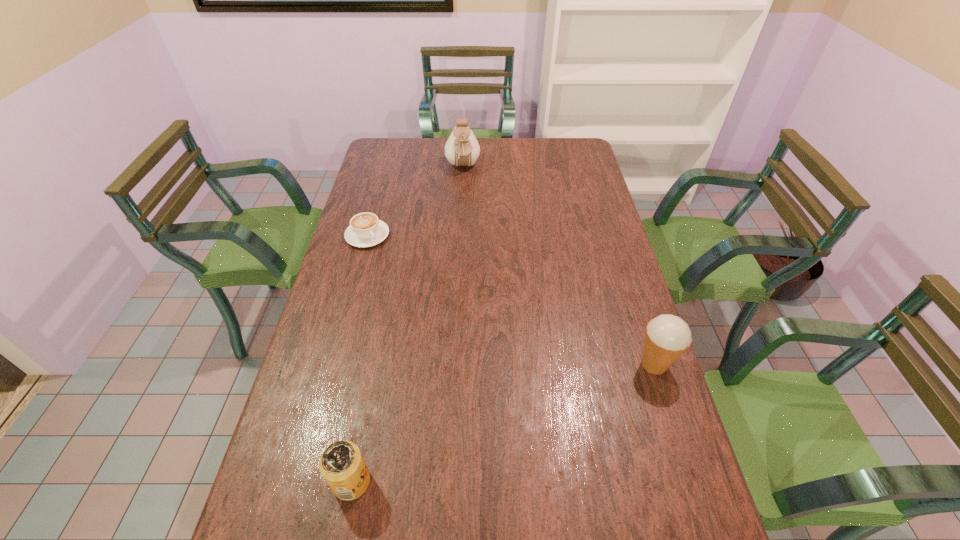
You are a GUI agent. You are given a task and a screenshot of the screen. Output one action in this format:
    pyautogui.click(x=<x>, y=<y>)
    Task: Click on the nearest object
    The image size is (960, 540).
    Given the screenshot: What is the action you would take?
    pyautogui.click(x=342, y=465)

Where is `the third tallest object`? the third tallest object is located at coordinates (342, 465).

Where is `the rightmost object`? the rightmost object is located at coordinates (667, 337).

Where is `the second nearest object`? This screenshot has height=540, width=960. the second nearest object is located at coordinates (667, 337).

Locate an element on the screen. pouch is located at coordinates (462, 149).

Locate an element on the screen. Image resolution: width=960 pixels, height=540 pixels. the farthest object is located at coordinates (462, 149).

Where is `cappuccino`? This screenshot has width=960, height=540. cappuccino is located at coordinates (365, 230).

Identify the location of the second farthest object. (365, 230).

Find the location of a particular element. The width and height of the screenshot is (960, 540). vacant space situated on the back of the beer can is located at coordinates (363, 424).

Find the location of `free region located on the left of the icecream`. free region located on the left of the icecream is located at coordinates (517, 364).